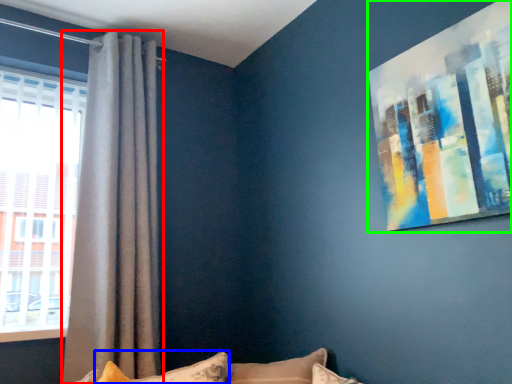
Question: Based on their relative distances, which object is farther from curtain (highlighted by a red box)? Choose from pillow (highlighted by a blue box) and picture frame (highlighted by a green box).

Choices:
 (A) pillow
 (B) picture frame

Answer: (B)